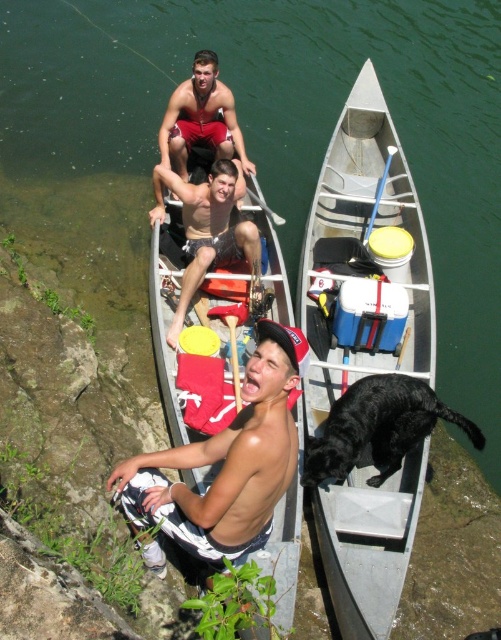
Question: Among these objects, which one is farthest from the camera?

Choices:
 (A) shiny white shorts at center
 (B) white plastic boat at center

Answer: (B)

Question: From the image, what is the correct spatial relationship of white plastic boat at center in relation to matte red shorts at upper center?

Choices:
 (A) right
 (B) left

Answer: (A)

Question: Which object appears closest to the camera in this image?

Choices:
 (A) yellow foam paddle at center
 (B) shiny white shorts at center
 (C) matte red canoe at center
 (D) matte red shorts at upper center

Answer: (B)

Question: Is matte red canoe at center further to the viewer compared to wooden paddle at center?

Choices:
 (A) yes
 (B) no

Answer: (B)

Question: In this image, where is matte red canoe at center located relative to wooden paddle at center?

Choices:
 (A) above
 (B) below

Answer: (B)

Question: Which is nearer to the shiny white shorts at center?

Choices:
 (A) matte black shorts at center
 (B) matte red canoe at center
 (C) yellow foam paddle at center

Answer: (B)